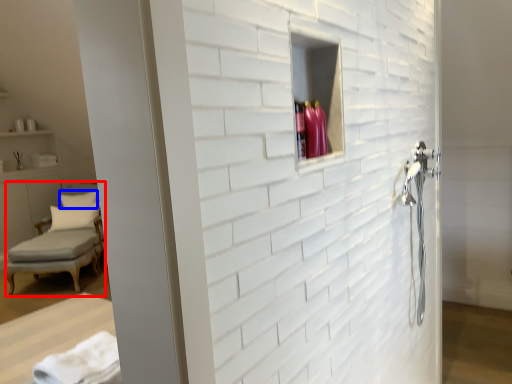
Question: Which of the following is the closest to the observer, chair (highlighted by a red box) or pillow (highlighted by a blue box)?

Choices:
 (A) chair
 (B) pillow

Answer: (A)